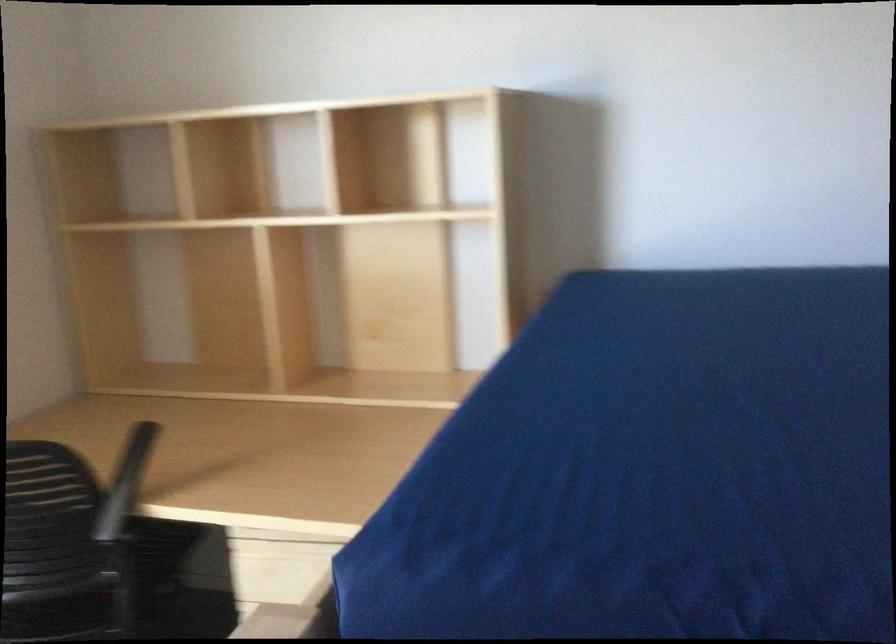
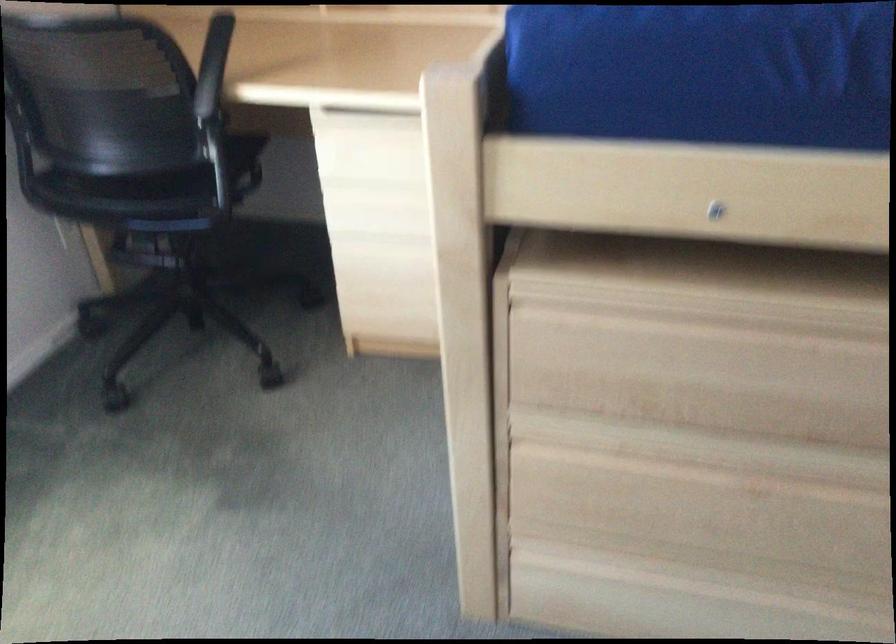
Find the pixel in the second image that matches (x=123, y=487) in the first image.

(212, 66)